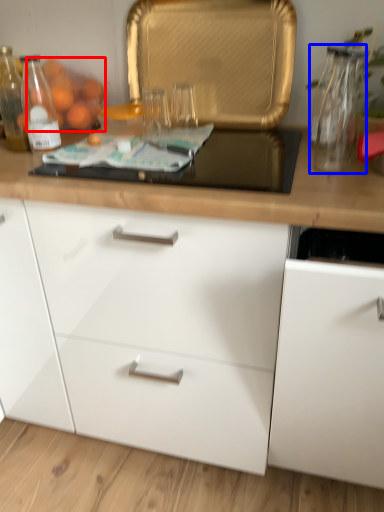
Question: Which of the following is the farthest to the observer, fruit (highlighted by a red box) or glass vase (highlighted by a blue box)?

Choices:
 (A) fruit
 (B) glass vase

Answer: (A)